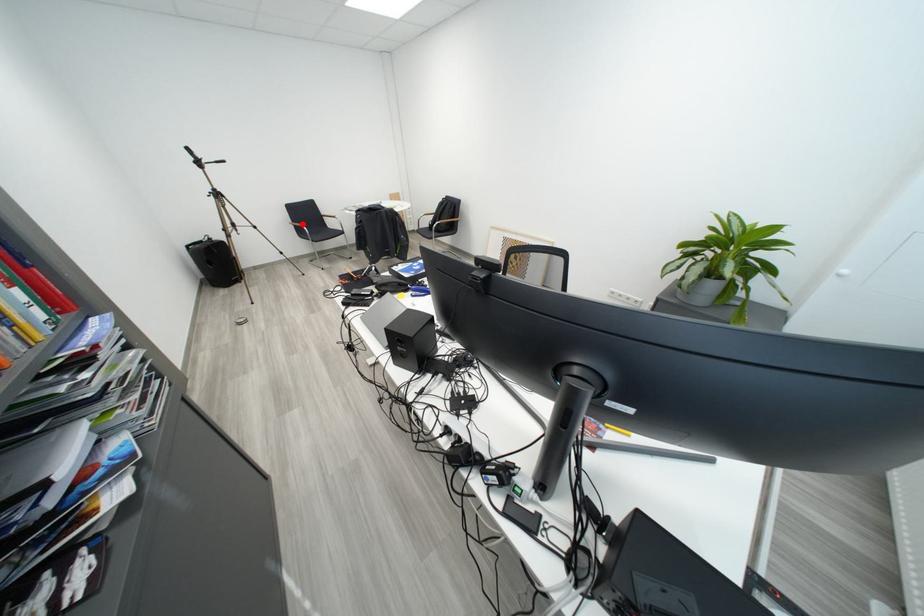
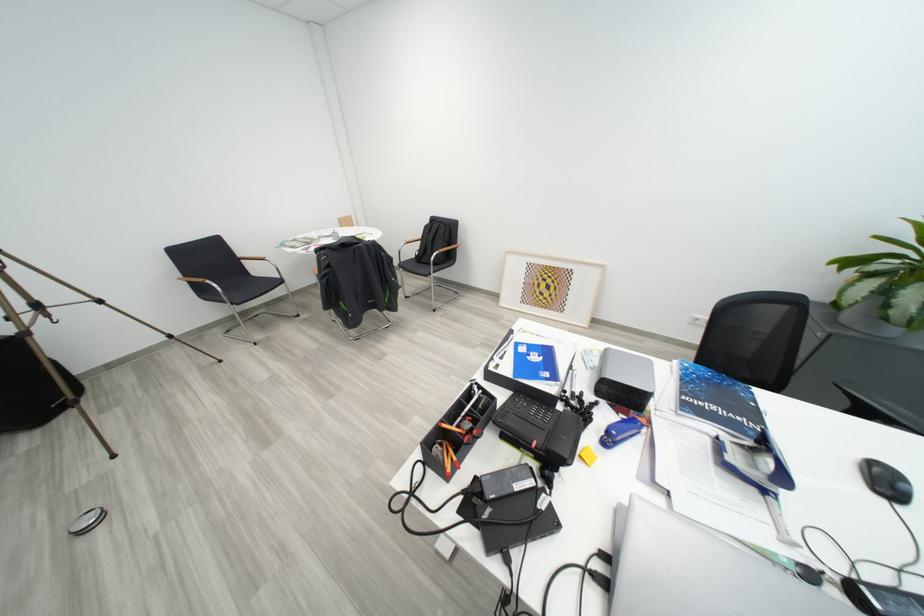
The point at the highlighted location is marked in the first image. Where is the corresponding point in the second image?

(195, 277)